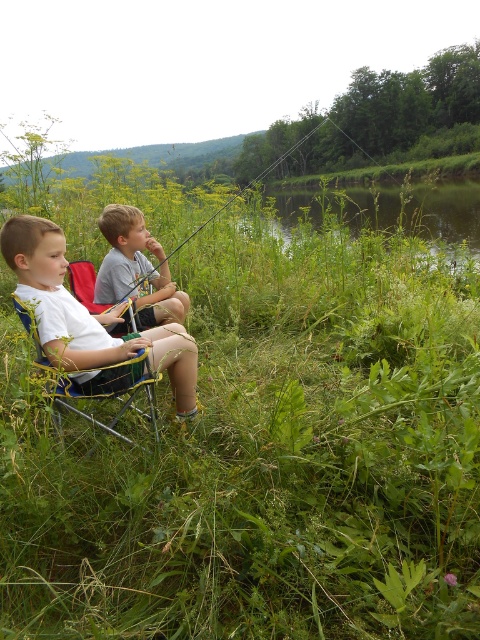
Question: Which point appears farthest from the camera in this image?

Choices:
 (A) (12, 632)
 (B) (118, 225)

Answer: (B)

Question: Can you confirm if green leafy grass at center is bigger than gray cotton shirt at center?

Choices:
 (A) no
 (B) yes

Answer: (B)

Question: Can you confirm if white fabric shorts at lower left is positioned to the left of blue fabric chair at left?

Choices:
 (A) yes
 (B) no

Answer: (B)

Question: Can you confirm if white fabric shorts at lower left is positioned to the right of yellow fabric chair at center?

Choices:
 (A) yes
 (B) no

Answer: (A)

Question: Which object is the farthest from the yellow fabric chair at center?

Choices:
 (A) blue fabric chair at left
 (B) gray cotton shirt at center

Answer: (B)

Question: Among these objects, which one is nearest to the camera?

Choices:
 (A) white fabric shorts at lower left
 (B) green leafy grass at center
 (C) gray cotton shirt at center
 (D) blue fabric chair at left

Answer: (B)